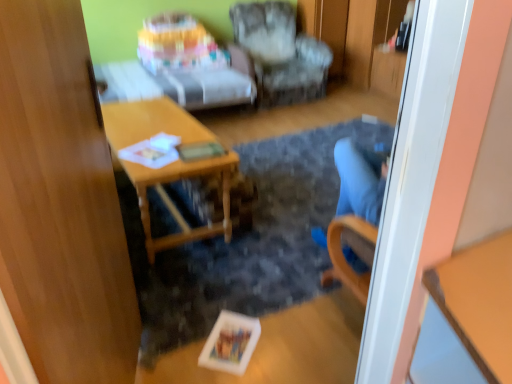
Question: Can you confirm if wooden desk at center is positioned to the left of textured fabric armchair at center?

Choices:
 (A) yes
 (B) no

Answer: (A)

Question: From the image's perspective, is wooden desk at center beneath textured fabric armchair at center?

Choices:
 (A) no
 (B) yes

Answer: (B)

Question: Could you tell me if wooden desk at center is facing textured fabric armchair at center?

Choices:
 (A) no
 (B) yes

Answer: (A)

Question: Considering the relative sizes of wooden desk at center and textured fabric armchair at center in the image provided, is wooden desk at center thinner than textured fabric armchair at center?

Choices:
 (A) no
 (B) yes

Answer: (B)

Question: Considering the relative positions of wooden desk at center and textured fabric armchair at center in the image provided, is wooden desk at center behind textured fabric armchair at center?

Choices:
 (A) yes
 (B) no

Answer: (B)

Question: Visually, is transparent wood door at left positioned to the left or to the right of textured fabric armchair at center?

Choices:
 (A) right
 (B) left

Answer: (B)

Question: Does point (122, 241) appear closer or farther from the camera than point (254, 61)?

Choices:
 (A) closer
 (B) farther

Answer: (A)

Question: From a real-world perspective, is transparent wood door at left above or below textured fabric armchair at center?

Choices:
 (A) below
 (B) above

Answer: (B)

Question: Relative to textured fabric armchair at center, is transparent wood door at left in front or behind?

Choices:
 (A) behind
 (B) front

Answer: (B)

Question: Looking at their shapes, would you say transparent wood door at left is wider or thinner than wooden desk at center?

Choices:
 (A) wide
 (B) thin

Answer: (B)

Question: From a real-world perspective, is transparent wood door at left above or below wooden desk at center?

Choices:
 (A) above
 (B) below

Answer: (A)

Question: Is point (60, 82) closer or farther from the camera than point (223, 226)?

Choices:
 (A) farther
 (B) closer

Answer: (B)

Question: From the image's perspective, is transparent wood door at left positioned above or below wooden desk at center?

Choices:
 (A) above
 (B) below

Answer: (B)

Question: Choose the correct answer: Is textured fabric armchair at center inside transparent wood door at left or outside it?

Choices:
 (A) outside
 (B) inside

Answer: (A)

Question: From their relative heights in the image, would you say textured fabric armchair at center is taller or shorter than transparent wood door at left?

Choices:
 (A) tall
 (B) short

Answer: (B)